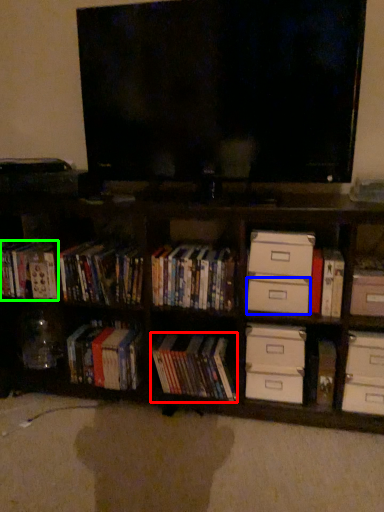
Question: Which object is positioned closest to book (highlighted by a red box)? Select from drawer (highlighted by a blue box) and book (highlighted by a green box).

Choices:
 (A) drawer
 (B) book

Answer: (A)